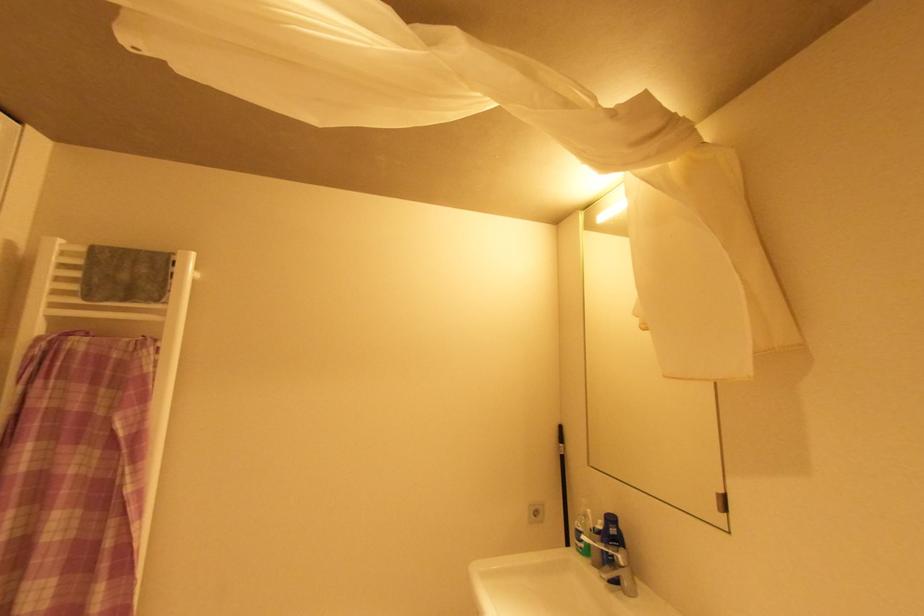
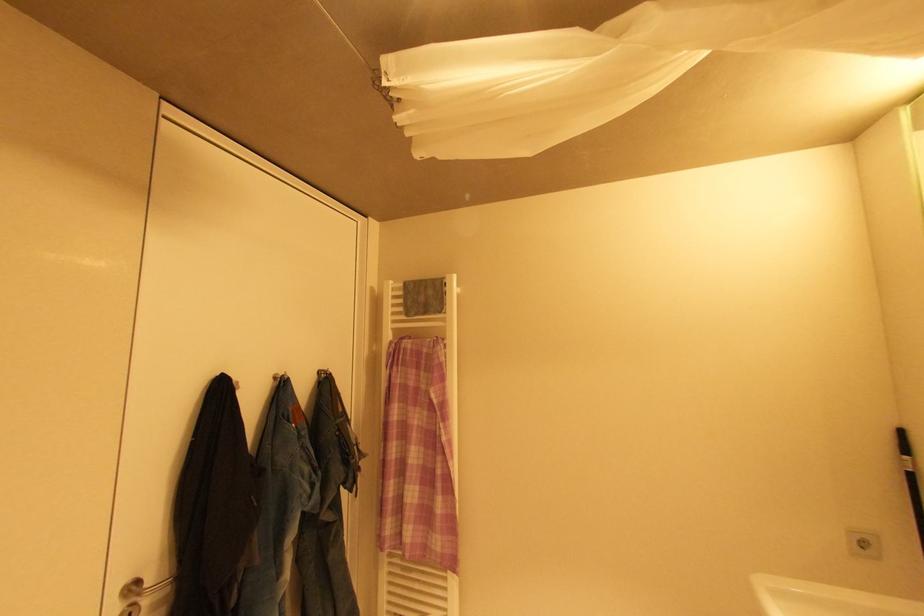
Question: The camera is either moving clockwise (left) or counter-clockwise (right) around the object. The first image is from the beginning of the video and the second image is from the end. Is the camera moving left or right when shooting the video?

Choices:
 (A) Left
 (B) Right

Answer: (B)